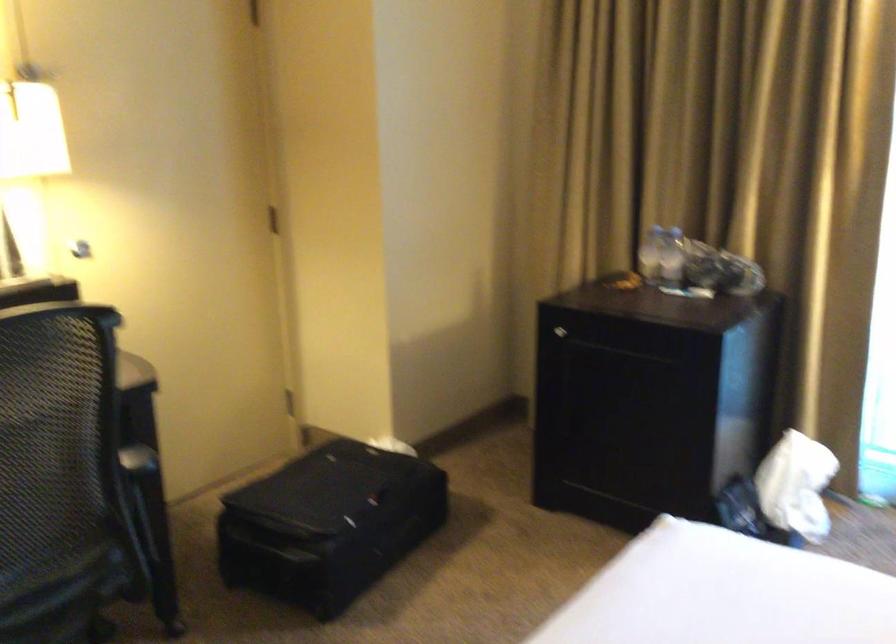
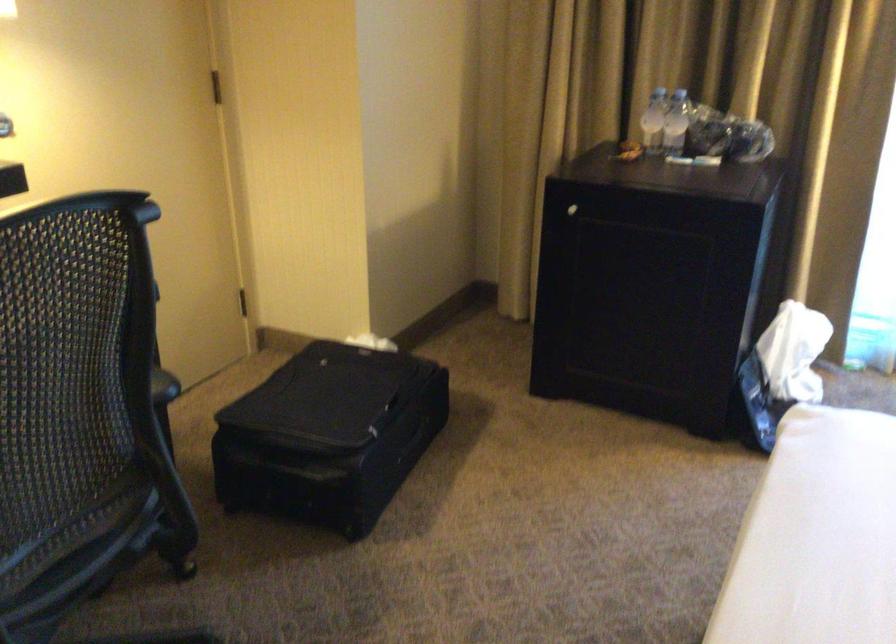
Question: I am providing you with two images of the same scene from different viewpoints. Which of the following objects are not visible in image2?

Choices:
 (A) clear water bottle
 (B) black suitcase
 (C) cabinet door handle
 (D) none of these

Answer: (D)